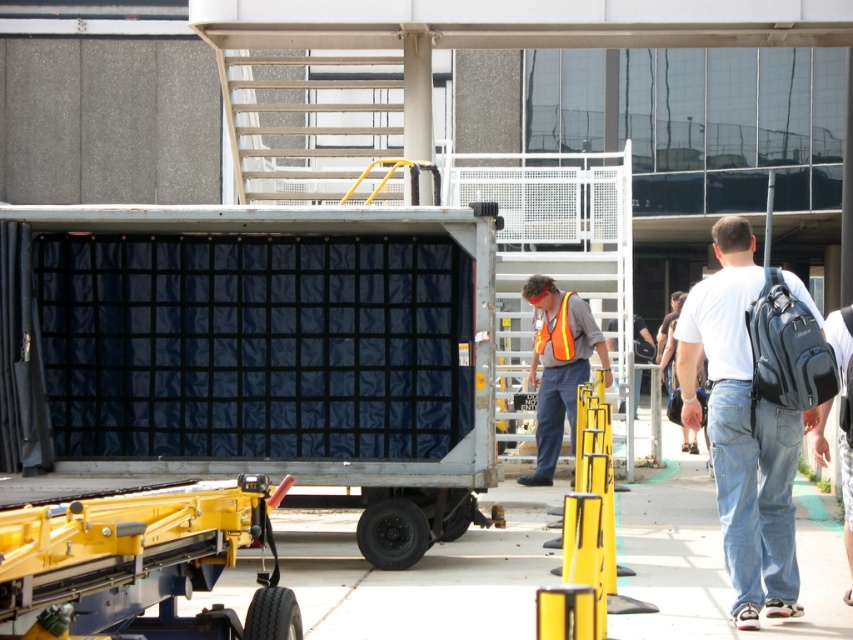
Question: Among these points, which one is farthest from the camera?

Choices:
 (A) (743, 268)
 (B) (569, 333)

Answer: (B)

Question: Does denim jeans at right have a smaller size compared to reflective orange safety vest at center?

Choices:
 (A) yes
 (B) no

Answer: (A)

Question: Considering the relative positions of denim jeans at right and reflective orange safety vest at center in the image provided, where is denim jeans at right located with respect to reflective orange safety vest at center?

Choices:
 (A) right
 (B) left

Answer: (A)

Question: Which object is closer to the camera taking this photo?

Choices:
 (A) reflective orange safety vest at center
 (B) denim jeans at right

Answer: (B)

Question: Does denim jeans at right appear over reflective orange safety vest at center?

Choices:
 (A) no
 (B) yes

Answer: (B)